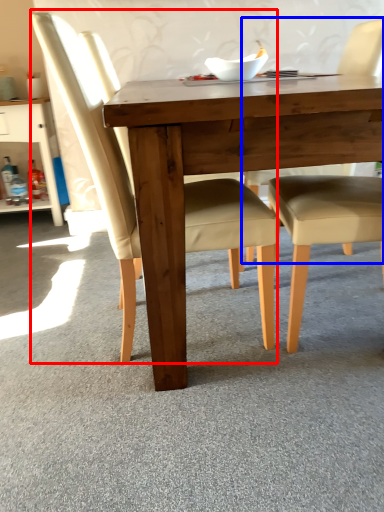
Question: Among these objects, which one is nearest to the camera, chair (highlighted by a red box) or chair (highlighted by a blue box)?

Choices:
 (A) chair
 (B) chair

Answer: (A)